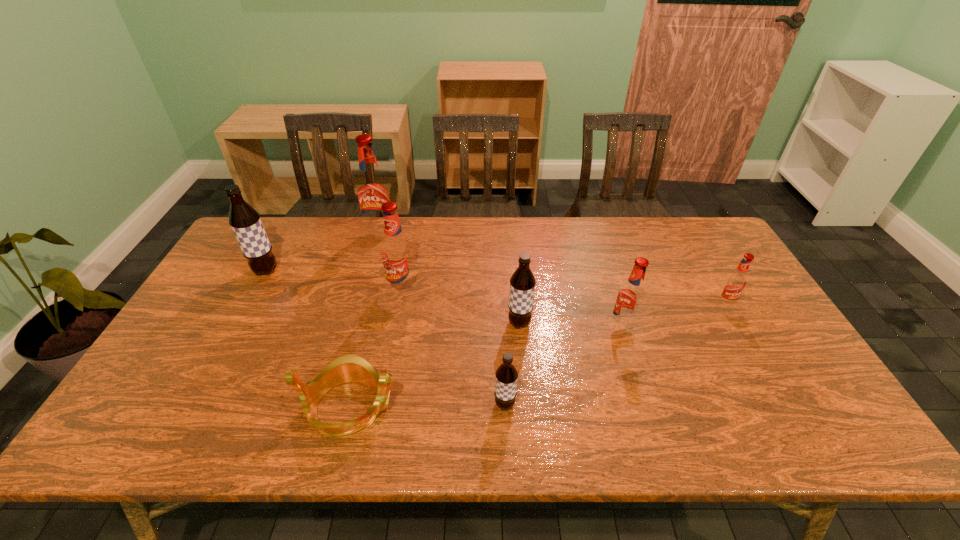
The width and height of the screenshot is (960, 540). Find the location of `the farthest red root beer`. the farthest red root beer is located at coordinates (372, 189).

Find the location of `the tallest root beer`. the tallest root beer is located at coordinates (372, 189).

This screenshot has height=540, width=960. I want to click on the fifth root beer from right to left, so click(396, 252).

Where is `the second red root beer from left to right`? This screenshot has height=540, width=960. the second red root beer from left to right is located at coordinates [x=396, y=252].

The image size is (960, 540). I want to click on the farthest brown root beer, so click(x=245, y=221).

Where is `the seventh nearest object`? The width and height of the screenshot is (960, 540). the seventh nearest object is located at coordinates (245, 221).

The image size is (960, 540). What are the coordinates of `the second object from right to left` in the screenshot? It's located at (630, 299).

The width and height of the screenshot is (960, 540). I want to click on the second smallest red root beer, so click(630, 299).

Find the location of a particular element. Image resolution: width=960 pixels, height=540 pixels. the second biggest brown root beer is located at coordinates (522, 282).

Locate an element on the screen. This screenshot has height=540, width=960. the rightmost object is located at coordinates (735, 283).